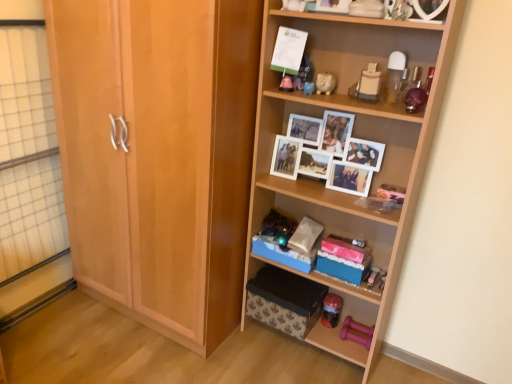
This screenshot has height=384, width=512. What are the coordinates of `free space in front of light brown wood cabinet at left` in the screenshot? It's located at (129, 360).